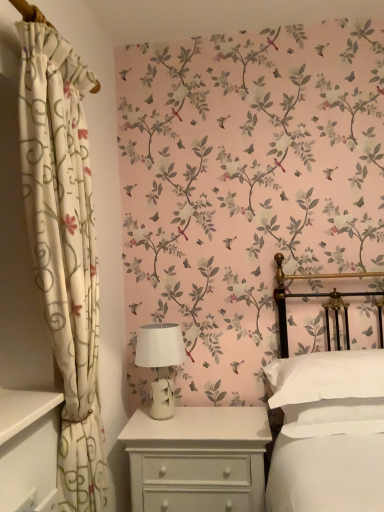
This screenshot has width=384, height=512. I want to click on free point in front of white ceramic table lamp at center, so click(x=173, y=429).